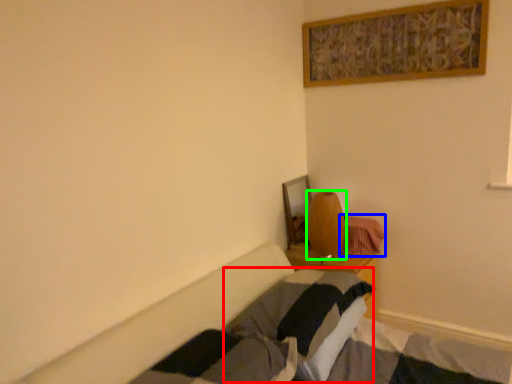
Question: Based on their relative distances, which object is nearer to pillow (highlighted by a red box)? Choose from blanket (highlighted by a blue box) and lamp (highlighted by a green box).

Choices:
 (A) blanket
 (B) lamp

Answer: (B)